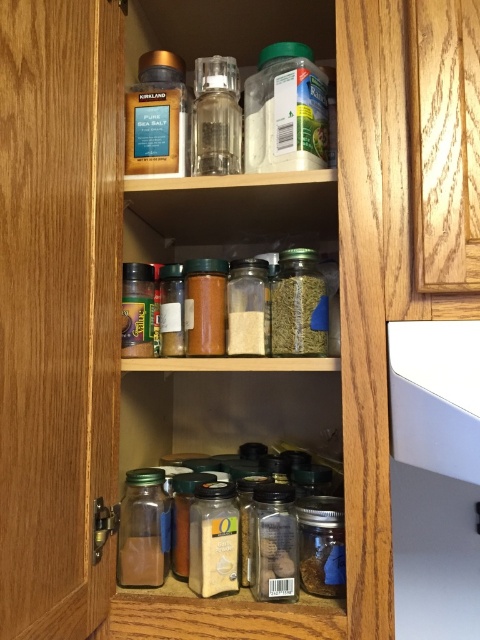
You are organizing the cabinet and need to stack the translucent glass jar at center and the clear glass jar at center vertically. Which jar should you place at the bottom to ensure stability?

The translucent glass jar at center should be placed at the bottom because it has a greater height compared to the clear glass jar at center, providing a more stable base.

You are organizing the cabinet and need to place both the translucent glass jars at center and the transparent glass grinder at center on the same shelf. Which object should you place first to ensure they both fit?

You should place the translucent glass jars at center first because they are larger than the transparent glass grinder at center, allowing enough space for both items.

You are organizing the cabinet and need to place a new item between the transparent glass grinder at center and the translucent glass jar at center. Where should you place it to ensure it fits between them?

Place the new item between the transparent glass grinder at center and the translucent glass jar at center, positioning it to the left of the transparent glass grinder at center and to the right of the translucent glass jar at center since the grinder is to the right of the jar.